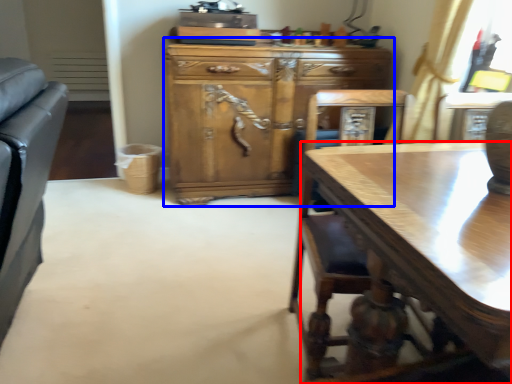
Question: Among these objects, which one is nearest to the camera, desk (highlighted by a red box) or cabinetry (highlighted by a blue box)?

Choices:
 (A) desk
 (B) cabinetry

Answer: (A)